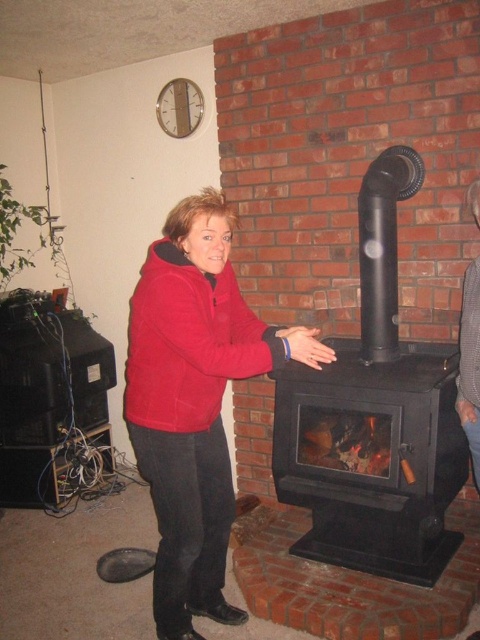
Question: Which object is farther from the camera taking this photo?

Choices:
 (A) black matte fireplace at center
 (B) red fleece jacket at center

Answer: (A)

Question: Can you confirm if black matte fireplace at center is smaller than red fleece jacket at center?

Choices:
 (A) no
 (B) yes

Answer: (A)

Question: Is black matte fireplace at center to the left of red fleece jacket at center from the viewer's perspective?

Choices:
 (A) no
 (B) yes

Answer: (A)

Question: Does black matte fireplace at center come behind red fleece jacket at center?

Choices:
 (A) no
 (B) yes

Answer: (B)